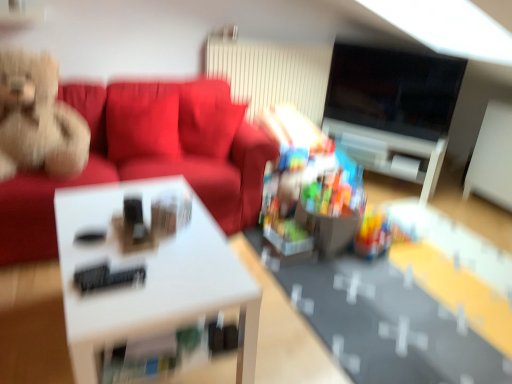
Question: From the image's perspective, is white glossy table at center located beneath fluffy beige teddy bear on the left, the 2th toy viewed from the right?

Choices:
 (A) no
 (B) yes

Answer: (B)

Question: From a real-world perspective, is white glossy table at center beneath fluffy beige teddy bear on the left, the 2th toy viewed from the right?

Choices:
 (A) no
 (B) yes

Answer: (B)

Question: From a real-world perspective, does white glossy table at center stand above fluffy beige teddy bear on the left, the first toy from the top?

Choices:
 (A) yes
 (B) no

Answer: (B)

Question: Is white glossy table at center not near fluffy beige teddy bear on the left, the 2th toy viewed from the right?

Choices:
 (A) yes
 (B) no

Answer: (B)

Question: Is white glossy table at center behind fluffy beige teddy bear on the left, the first toy from the top?

Choices:
 (A) no
 (B) yes

Answer: (A)

Question: Considering their positions, is suede-like red couch at upper left located in front of or behind translucent plastic toy at center, arranged as the 1th toy when viewed from the right?

Choices:
 (A) behind
 (B) front

Answer: (B)

Question: In terms of width, does suede-like red couch at upper left look wider or thinner when compared to translucent plastic toy at center, the second toy in the top-to-bottom sequence?

Choices:
 (A) wide
 (B) thin

Answer: (A)

Question: From a real-world perspective, is suede-like red couch at upper left physically located above or below translucent plastic toy at center, which is counted as the first toy, starting from the bottom?

Choices:
 (A) above
 (B) below

Answer: (A)

Question: Looking at the image, does suede-like red couch at upper left seem bigger or smaller compared to translucent plastic toy at center, the 2th toy from the left?

Choices:
 (A) big
 (B) small

Answer: (A)

Question: Is point (242, 292) closer or farther from the camera than point (329, 99)?

Choices:
 (A) farther
 (B) closer

Answer: (B)

Question: From the image's perspective, is white glossy table at center above or below black glossy tv at upper right?

Choices:
 (A) above
 (B) below

Answer: (B)

Question: Is white glossy table at center to the left or to the right of black glossy tv at upper right in the image?

Choices:
 (A) left
 (B) right

Answer: (A)

Question: Is white glossy table at center inside the boundaries of black glossy tv at upper right, or outside?

Choices:
 (A) inside
 (B) outside

Answer: (B)

Question: Would you say white glossy table at center is to the left or to the right of fluffy beige teddy bear on the left, the 2th toy viewed from the right, in the picture?

Choices:
 (A) left
 (B) right

Answer: (B)

Question: From a real-world perspective, relative to fluffy beige teddy bear on the left, the first toy from the top, is white glossy table at center vertically above or below?

Choices:
 (A) above
 (B) below

Answer: (B)